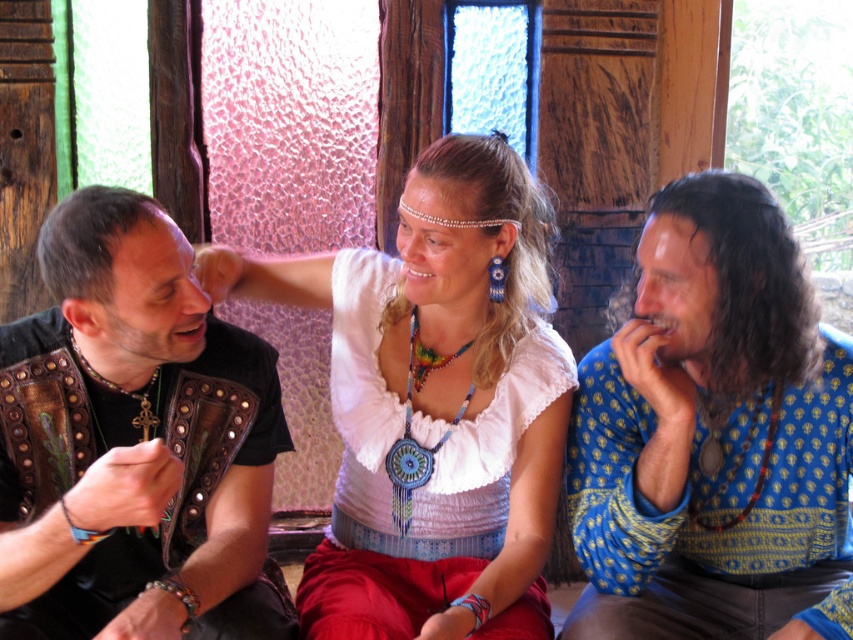
Question: From the image, what is the correct spatial relationship of white fabric blouse at center in relation to blue printed shirt at center?

Choices:
 (A) below
 (B) above

Answer: (B)

Question: Which object is farther from the camera taking this photo?

Choices:
 (A) rainbow beaded necklace at center
 (B) leather vest at left

Answer: (A)

Question: Is blue printed shirt at center positioned before rainbow beaded necklace at center?

Choices:
 (A) yes
 (B) no

Answer: (A)

Question: Which object is the farthest from the leather vest at left?

Choices:
 (A) white fabric blouse at center
 (B) rainbow beaded necklace at center

Answer: (B)

Question: Is white fabric blouse at center below rainbow beaded necklace at center?

Choices:
 (A) no
 (B) yes

Answer: (B)

Question: Which point is closer to the camera taking this photo?

Choices:
 (A) (483, 556)
 (B) (270, 451)
 (C) (426, 376)
 (D) (753, 332)

Answer: (D)